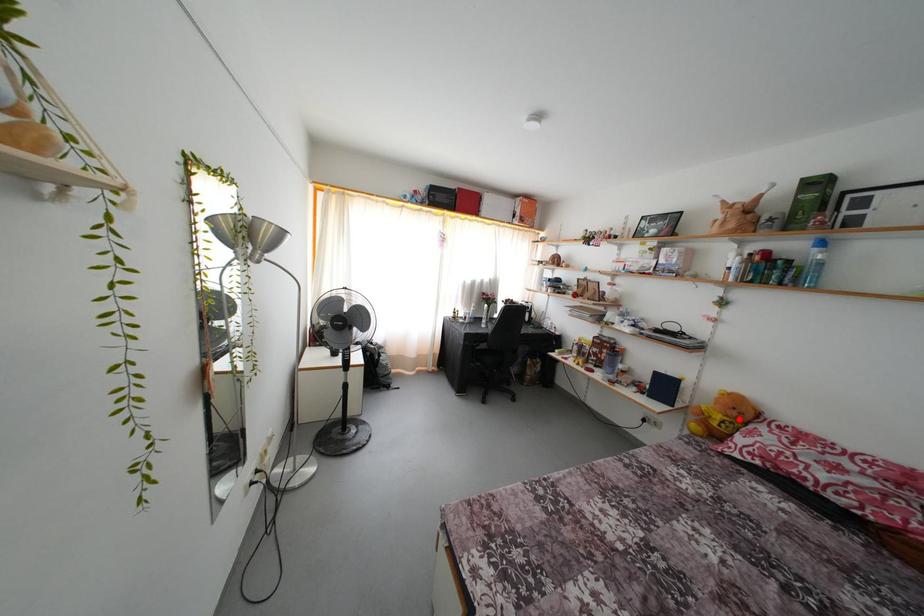
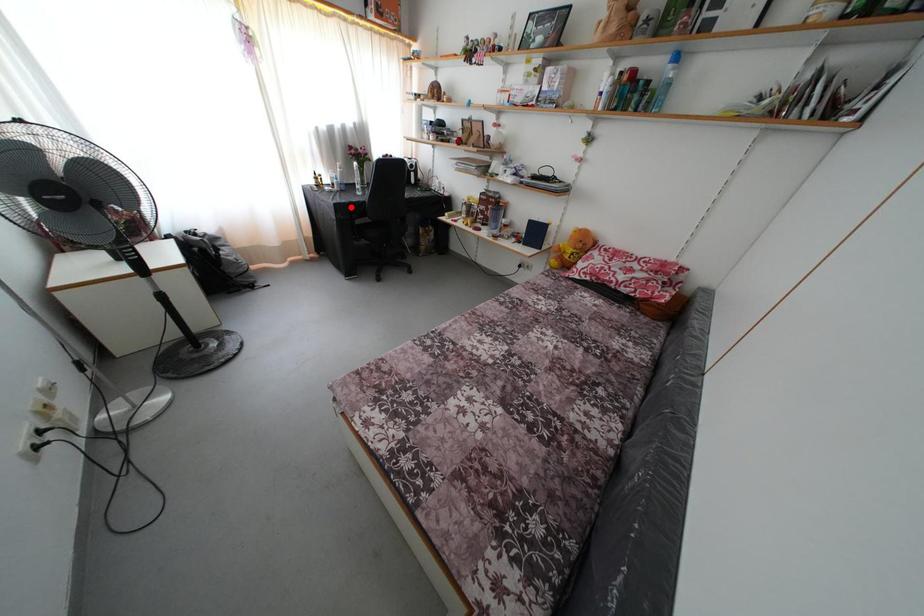
I am providing you with two images of the same scene from different viewpoints. A red point is marked on the first image and another point is marked on the second image. Are the points marked in image1 and image2 representing the same 3D position?

No